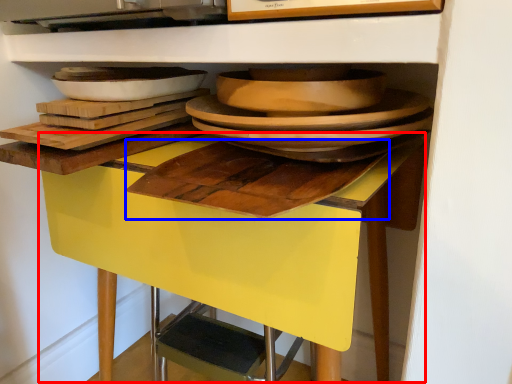
Question: Which object appears farthest to the camera in this image, table (highlighted by a red box) or cutting board (highlighted by a blue box)?

Choices:
 (A) table
 (B) cutting board

Answer: (A)